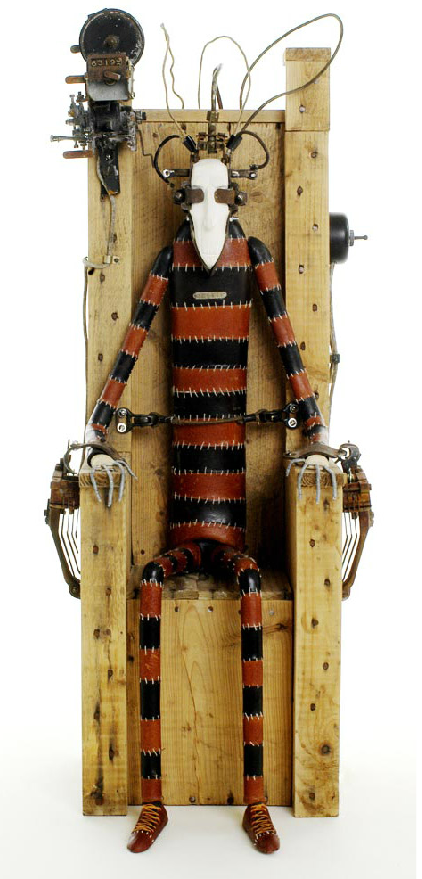
The image size is (422, 879). I want to click on chair, so click(x=196, y=694).